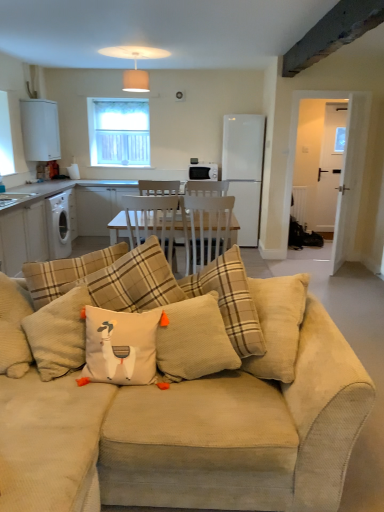
Question: Considering the positions of beige corduroy couch at center and white glossy sink at left in the image, is beige corduroy couch at center wider or thinner than white glossy sink at left?

Choices:
 (A) wide
 (B) thin

Answer: (A)

Question: Is beige corduroy couch at center taller or shorter than white glossy sink at left?

Choices:
 (A) tall
 (B) short

Answer: (A)

Question: Estimate the real-world distances between objects in this image. Which object is closer to the white cotton cushion with orange tassels at center?

Choices:
 (A) beige corduroy pillow at center, which appears as the 2th pillow when viewed from the right
 (B) black matte toaster at center, which is the second appliance in right-to-left order
 (C) clear glass window at upper center
 (D) white textured cushion at center, arranged as the second pillow when viewed from the left
 (E) dark gray concrete beam at upper right

Answer: (D)

Question: Which is nearer to the white glossy sink at left?

Choices:
 (A) dark gray concrete beam at upper right
 (B) white cotton cushion with orange tassels at center
 (C) white matte refrigerator at center, the 2th appliance from the left
 (D) clear glass window at upper center
 (E) beige corduroy pillow at center, which appears as the 2th pillow when viewed from the right

Answer: (D)